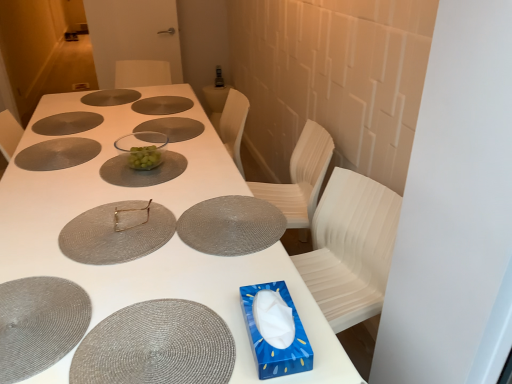
I want to click on vacant space that's between matte gray glass plate at upper left, which is counted as the 7th glass plate, starting from the front, and matte gray glass plate at upper center, which ranks as the 1th glass plate in back-to-front order, so click(92, 107).